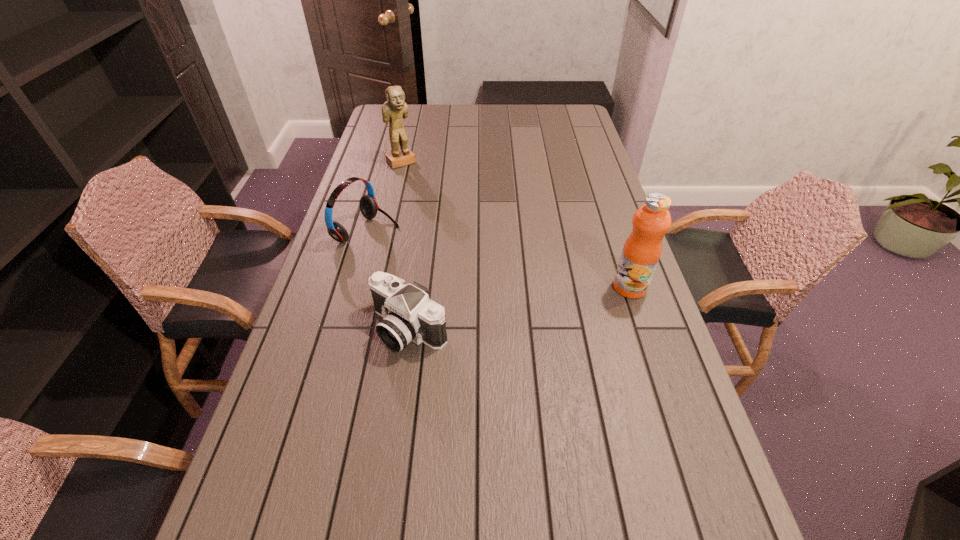
This screenshot has width=960, height=540. In order to click on camera in this screenshot , I will do `click(409, 315)`.

Where is `the shortest object`? the shortest object is located at coordinates 409,315.

This screenshot has width=960, height=540. What are the coordinates of `the rightmost object` in the screenshot? It's located at (642, 250).

Find the location of a particular element. This screenshot has height=540, width=960. fruit juice is located at coordinates (642, 250).

You are a GUI agent. You are given a task and a screenshot of the screen. Output one action in this format:
    pyautogui.click(x=<x>, y=<y>)
    Task: Click on the farthest object
    This screenshot has width=960, height=540.
    Given the screenshot: What is the action you would take?
    pyautogui.click(x=395, y=108)

This screenshot has width=960, height=540. What are the coordinates of `the second shortest object` in the screenshot? It's located at (368, 205).

Identify the location of the second farthest object. 368,205.

Where is `free location located on the front of the nearest object`? free location located on the front of the nearest object is located at coordinates (396, 426).

Find the location of a particular element. This screenshot has height=540, width=960. free space located 0.140m on the front of the rightmost object is located at coordinates (648, 341).

Locate an element on the screen. The height and width of the screenshot is (540, 960). vacant point located 0.270m on the front-facing side of the figurine is located at coordinates (443, 205).